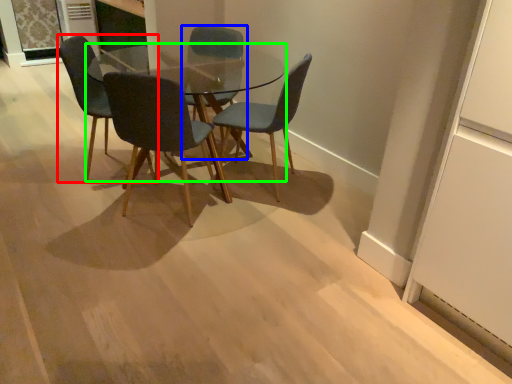
Question: Which is farther away from chair (highlighted by a red box)? chair (highlighted by a blue box) or coffee table (highlighted by a green box)?

Choices:
 (A) chair
 (B) coffee table

Answer: (B)